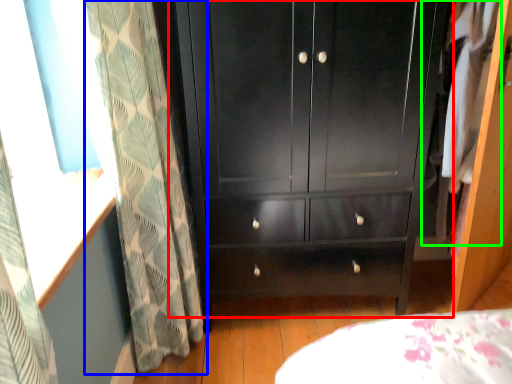
Question: Considering the real-world distances, which object is farthest from cupboard (highlighted by a red box)? curtain (highlighted by a blue box) or clothing (highlighted by a green box)?

Choices:
 (A) curtain
 (B) clothing

Answer: (B)